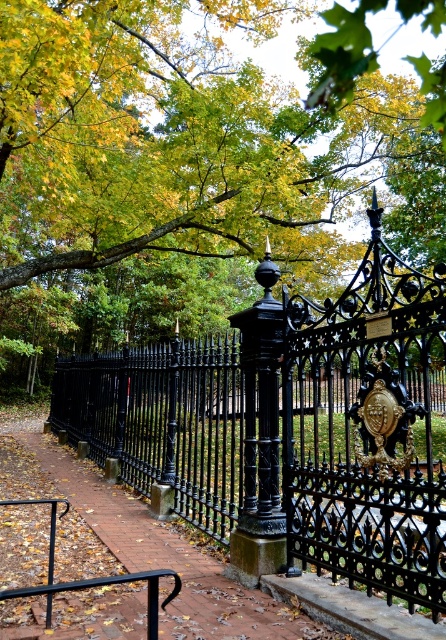
Question: Which of the following is the closest to the observer?

Choices:
 (A) black wrought iron fence at center
 (B) brown brick path at center

Answer: (A)

Question: Among these points, which one is nearest to the camera?

Choices:
 (A) (24, 424)
 (B) (244, 292)

Answer: (A)

Question: Does green leafy tree at upper center appear on the left side of brown brick path at center?

Choices:
 (A) no
 (B) yes

Answer: (A)

Question: Which of the following is the closest to the observer?

Choices:
 (A) black wrought iron fence at center
 (B) brown brick path at center
 (C) green leafy tree at upper center

Answer: (A)

Question: Is green leafy tree at upper center below black wrought iron fence at center?

Choices:
 (A) yes
 (B) no

Answer: (B)

Question: Does green leafy tree at upper center appear under black wrought iron fence at center?

Choices:
 (A) no
 (B) yes

Answer: (A)